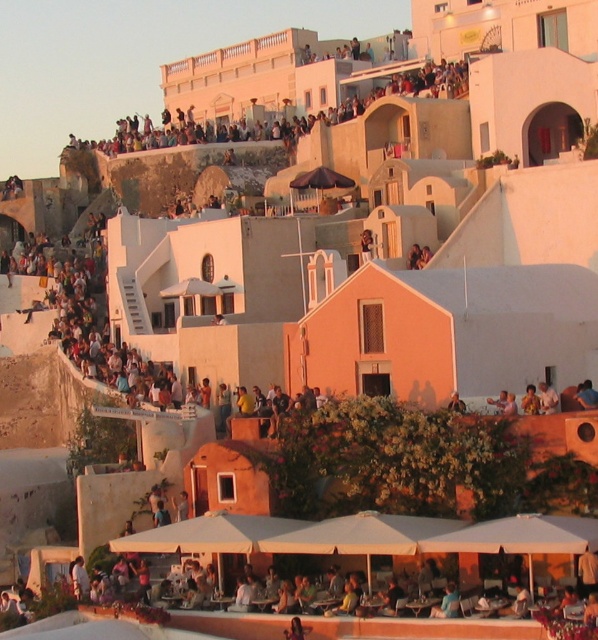
Question: Is matte white crowd at upper center bigger than white fabric umbrella at lower center?

Choices:
 (A) yes
 (B) no

Answer: (A)

Question: Does matte white crowd at upper center come behind white fabric umbrella at lower center?

Choices:
 (A) yes
 (B) no

Answer: (A)

Question: Based on their relative distances, which object is farther from the white fabric umbrella at lower center?

Choices:
 (A) smooth tan skin at center
 (B) matte white crowd at upper center

Answer: (B)

Question: Which point is closer to the camera?

Choices:
 (A) smooth tan skin at center
 (B) matte white crowd at upper center

Answer: (A)

Question: Can you confirm if matte white crowd at upper center is positioned to the right of white fabric umbrella at lower center?

Choices:
 (A) yes
 (B) no

Answer: (B)

Question: Which of these objects is positioned farthest from the smooth tan skin at center?

Choices:
 (A) matte white crowd at upper center
 (B) white fabric umbrella at lower center

Answer: (A)